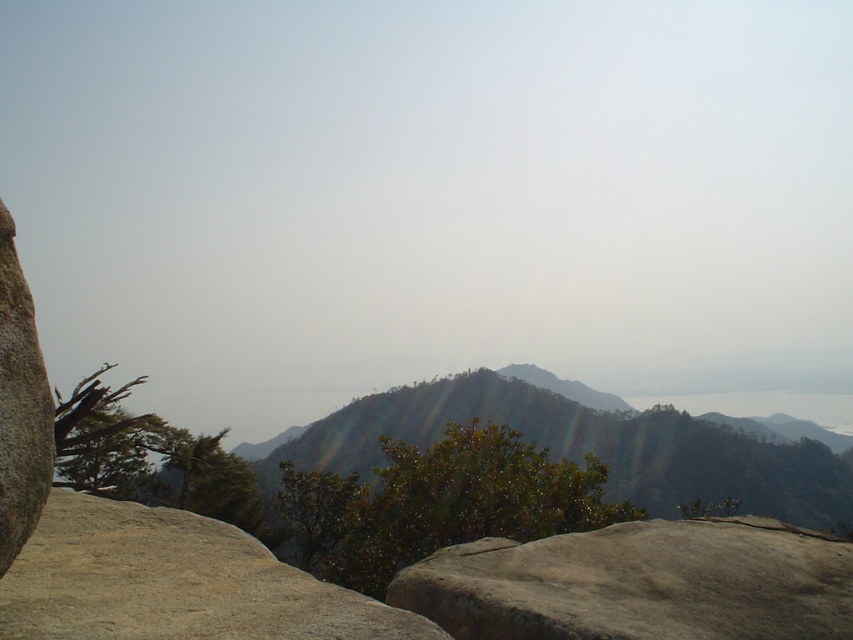
Question: Estimate the real-world distances between objects in this image. Which object is farther from the smooth gray rock at center?

Choices:
 (A) granite boulder at left
 (B) green leafy mountain at center
 (C) smooth beige rock at lower left

Answer: (B)

Question: Is the position of smooth beige rock at lower left less distant than that of granite boulder at left?

Choices:
 (A) yes
 (B) no

Answer: (B)

Question: Does smooth gray rock at center have a smaller size compared to granite boulder at left?

Choices:
 (A) no
 (B) yes

Answer: (A)

Question: Based on their relative distances, which object is farther from the granite boulder at left?

Choices:
 (A) smooth gray rock at center
 (B) green leafy mountain at center

Answer: (B)

Question: Which object is closer to the camera taking this photo?

Choices:
 (A) smooth beige rock at lower left
 (B) green leafy mountain at center
 (C) granite boulder at left
 (D) smooth gray rock at center

Answer: (C)

Question: Can you confirm if smooth gray rock at center is bigger than granite boulder at left?

Choices:
 (A) yes
 (B) no

Answer: (A)